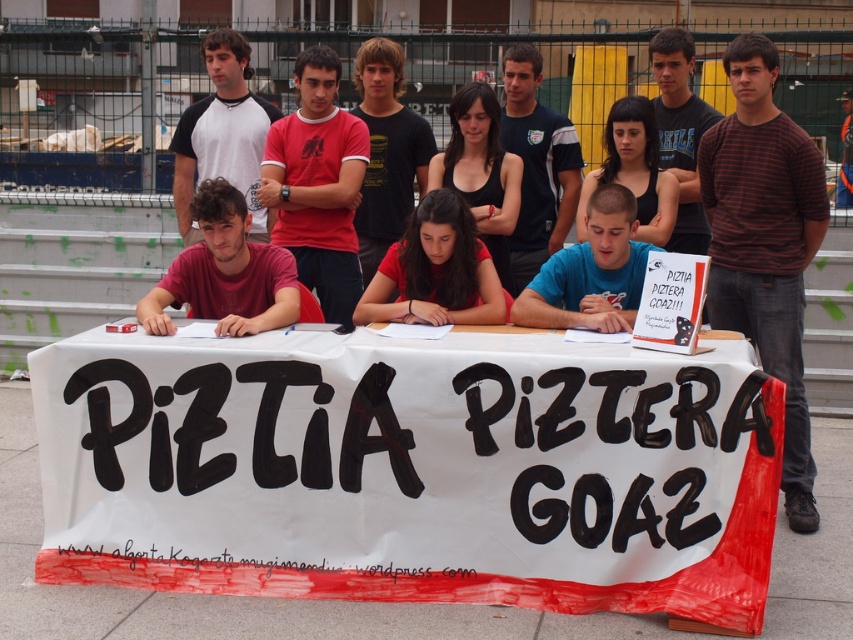
Question: Which point is farther to the camera?

Choices:
 (A) matte black tank top at center
 (B) white paper table at center

Answer: (A)

Question: Does white paper table at center lie in front of matte black tank top at center?

Choices:
 (A) no
 (B) yes

Answer: (B)

Question: Does white paper table at center appear on the left side of matte black tank top at center?

Choices:
 (A) yes
 (B) no

Answer: (A)

Question: Which object is positioned closest to the white paper table at center?

Choices:
 (A) matte red shirt at center
 (B) matte black tank top at center

Answer: (A)

Question: Can you confirm if white paper table at center is wider than matte black tank top at center?

Choices:
 (A) no
 (B) yes

Answer: (B)

Question: Which of the following is the closest to the observer?

Choices:
 (A) (631, 154)
 (B) (401, 300)

Answer: (B)